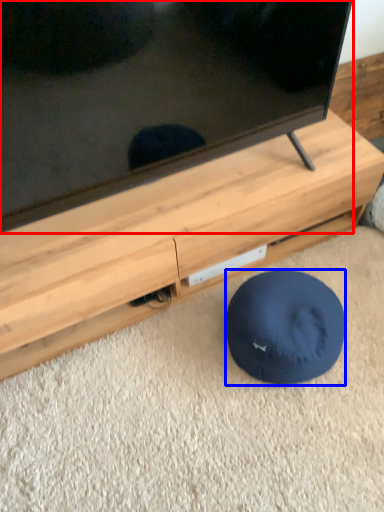
Question: Among these objects, which one is nearest to the camera, television (highlighted by a red box) or dog bed (highlighted by a blue box)?

Choices:
 (A) television
 (B) dog bed

Answer: (A)